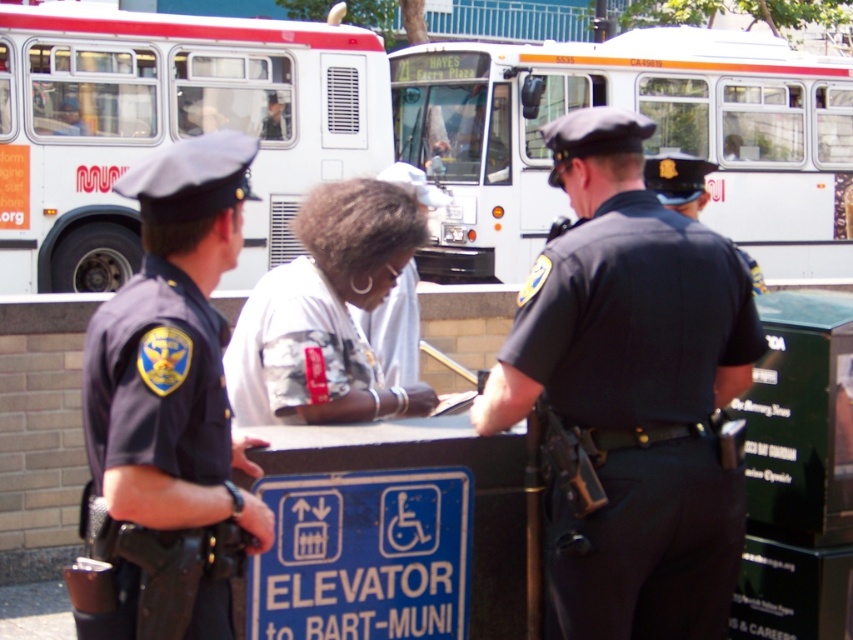
You are a pedestrian who needs to cross the street safely. You see a white matte bus at center and a dark blue uniform at left. Which object should you look towards first to check for traffic signals?

You should look towards the white matte bus at center first because it is positioned to the right of the dark blue uniform at left, indicating it might be closer to the street where traffic signals are located.

You are a pedestrian trying to find the elevator in the station. You see a dark blue uniform at left and a white fabric shirt at center. According to the scene, which direction should you head towards to locate the elevator?

The elevator is indicated by the blue sign with white symbols at the kiosk where the white fabric shirt at center is located. Head towards the white fabric shirt at center to find the elevator.

You are a city planner assessing traffic flow. You need to determine if the white matte bus at upper left can pass through a narrow alley that is only as wide as the dark blue uniform at left. Based on the scene, what is your conclusion?

The white matte bus at upper left is wider than the dark blue uniform at left. Since the alley is only as wide as the dark blue uniform at left, the bus cannot pass through the alley.